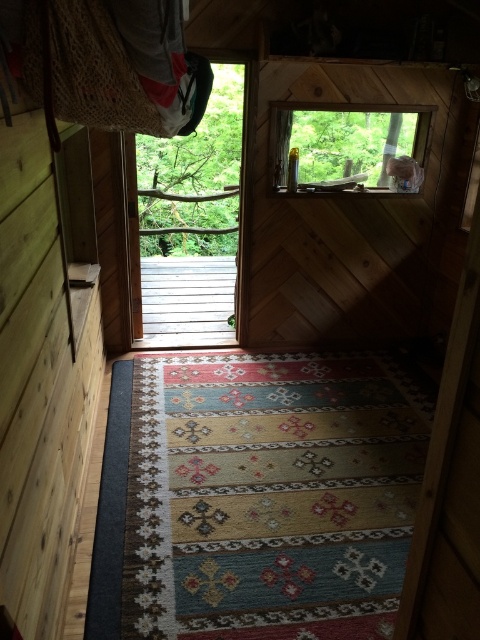
Question: Is transparent glass door at left above transparent glass window at upper center?

Choices:
 (A) no
 (B) yes

Answer: (B)

Question: Is transparent glass door at left smaller than transparent glass window at upper center?

Choices:
 (A) no
 (B) yes

Answer: (A)

Question: Which of the following is the farthest from the observer?

Choices:
 (A) (x=334, y=113)
 (B) (x=137, y=188)

Answer: (A)

Question: Can you confirm if transparent glass door at left is positioned below transparent glass window at upper center?

Choices:
 (A) yes
 (B) no

Answer: (B)

Question: Which of the following is the farthest from the observer?

Choices:
 (A) click(238, 212)
 (B) click(416, 136)

Answer: (A)